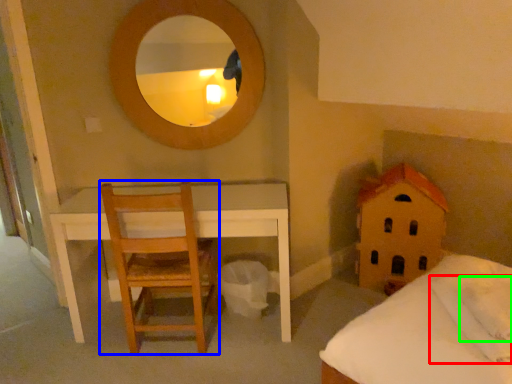
Question: Which is farther away from pillow (highlighted by a red box)? chair (highlighted by a blue box) or pillow (highlighted by a green box)?

Choices:
 (A) chair
 (B) pillow

Answer: (A)